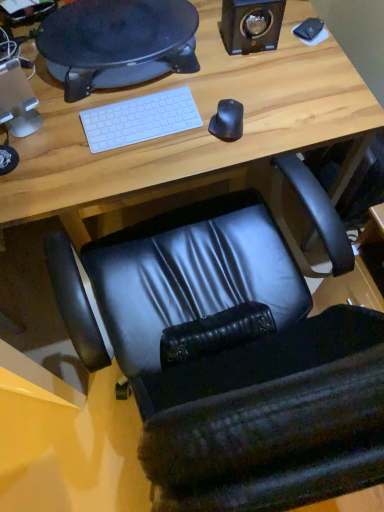
Identify the location of free space in front of matte black desk at upper center. This screenshot has height=512, width=384. (106, 149).